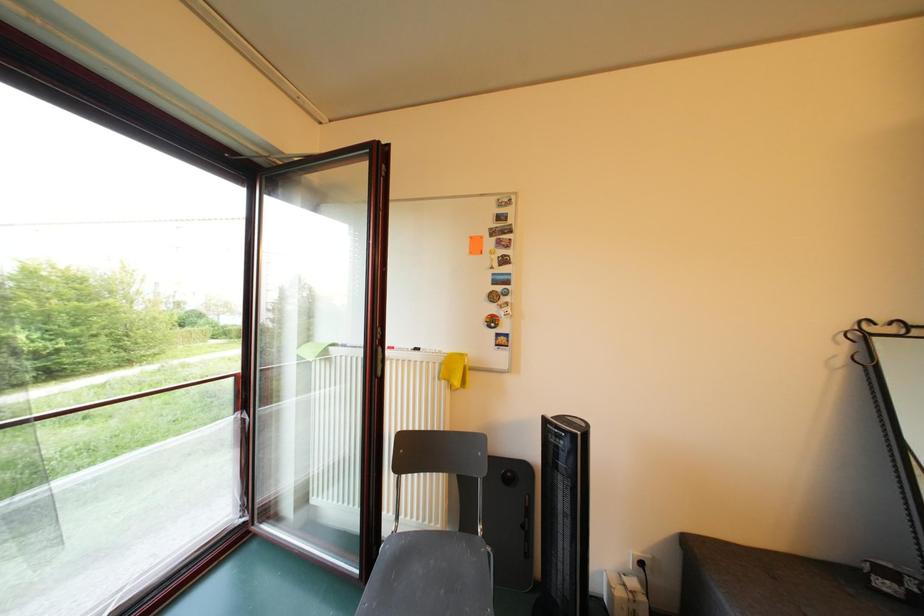
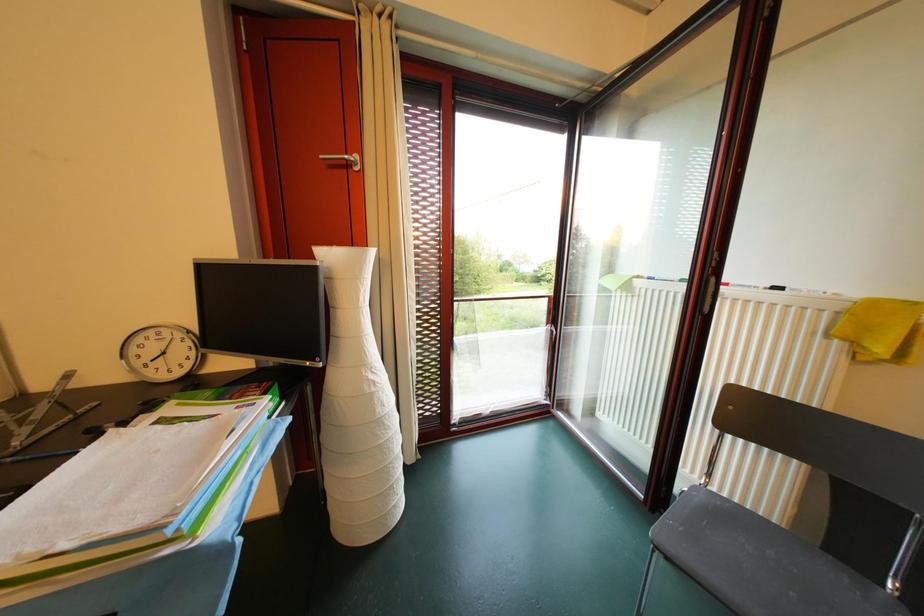
Question: The camera is either moving clockwise (left) or counter-clockwise (right) around the object. The first image is from the beginning of the video and the second image is from the end. Is the camera moving left or right when shooting the video?

Choices:
 (A) Left
 (B) Right

Answer: (B)